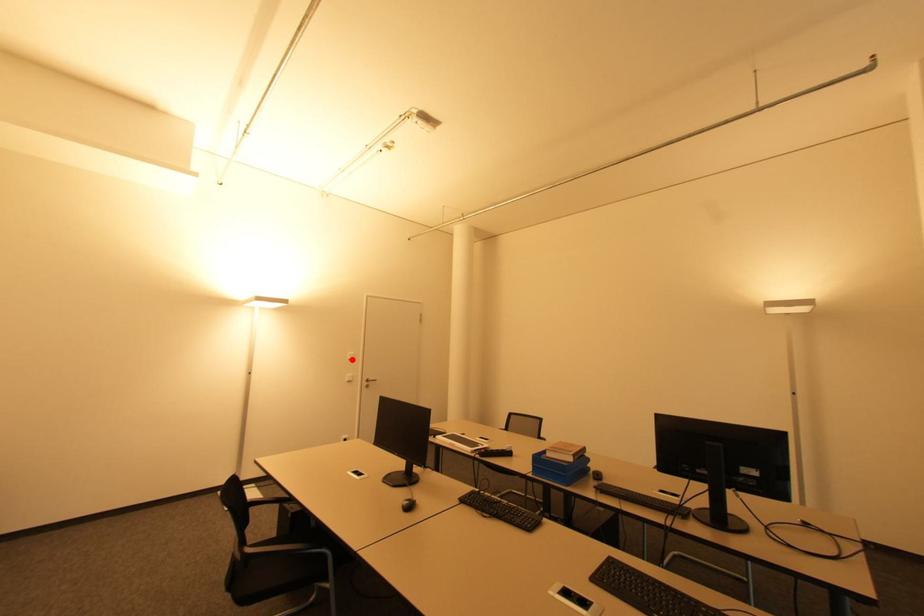
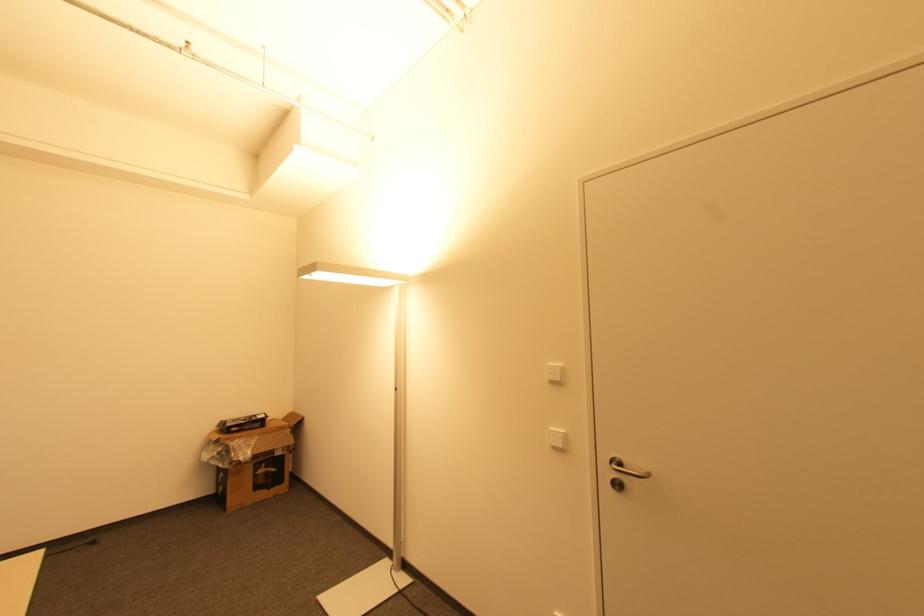
The point at the highlighted location is marked in the first image. Where is the corresponding point in the second image?

(554, 383)